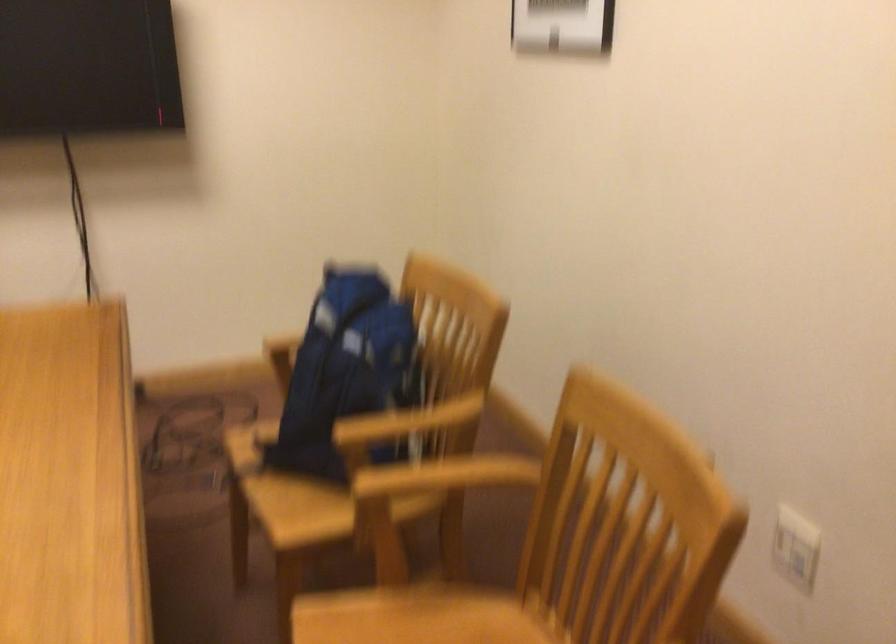
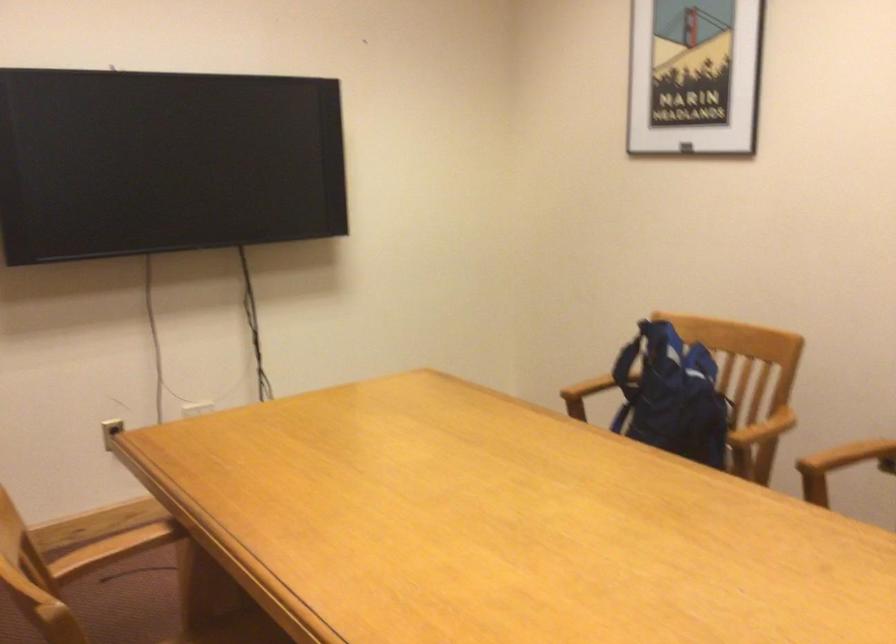
Locate, in the second image, the point that corresponds to (463,478) in the first image.

(849, 456)